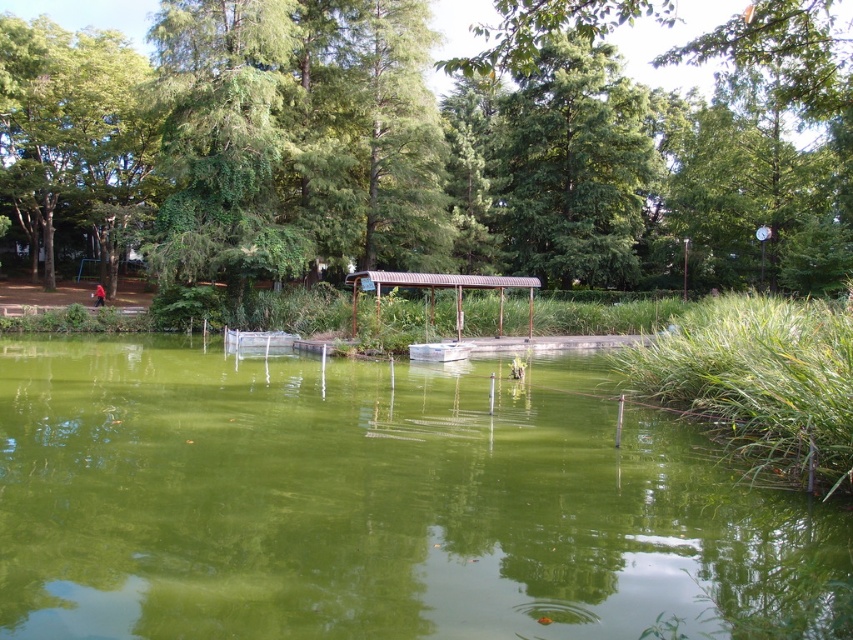
Is green algae water at center wider than green leafy tree at upper left?

In fact, green algae water at center might be narrower than green leafy tree at upper left.

What do you see at coordinates (380, 504) in the screenshot?
I see `green algae water at center` at bounding box center [380, 504].

Identify the location of green algae water at center. (380, 504).

Can you confirm if green leafy tree at center is thinner than green leafy tree at upper left?

No, green leafy tree at center is not thinner than green leafy tree at upper left.

Is point (77, 157) in front of point (111, 272)?

Yes, it is.

Is point (39, 211) positioned after point (102, 179)?

That is True.

Identify the location of green leafy tree at center. (431, 145).

Is point (387, 595) more distant than point (621, 180)?

No, (387, 595) is in front of (621, 180).

Consider the image. Between green algae water at center and green leafy tree at upper center, which one appears on the right side from the viewer's perspective?

From the viewer's perspective, green leafy tree at upper center appears more on the right side.

What do you see at coordinates (380, 504) in the screenshot? I see `green algae water at center` at bounding box center [380, 504].

The height and width of the screenshot is (640, 853). What are the coordinates of `green algae water at center` in the screenshot? It's located at (380, 504).